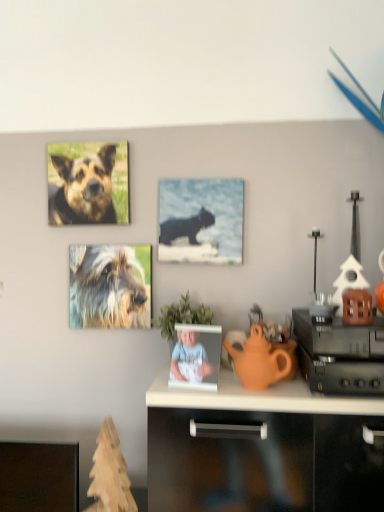
Question: Considering the relative sizes of orange matte teapot at center and matte black cat at center in the image provided, is orange matte teapot at center wider than matte black cat at center?

Choices:
 (A) yes
 (B) no

Answer: (A)

Question: Is orange matte teapot at center further to camera compared to matte black cat at center?

Choices:
 (A) no
 (B) yes

Answer: (A)

Question: From the image's perspective, would you say orange matte teapot at center is shown under matte black cat at center?

Choices:
 (A) yes
 (B) no

Answer: (A)

Question: Can you confirm if orange matte teapot at center is positioned to the right of matte black cat at center?

Choices:
 (A) no
 (B) yes

Answer: (B)

Question: Would you say matte black cat at center is part of orange matte teapot at center's contents?

Choices:
 (A) no
 (B) yes

Answer: (A)

Question: Is orange matte teapot at center aimed at matte black cat at center?

Choices:
 (A) yes
 (B) no

Answer: (B)

Question: Is green leafy plant at center at the left side of brown matte house at right?

Choices:
 (A) no
 (B) yes

Answer: (B)

Question: From a real-world perspective, is green leafy plant at center below brown matte house at right?

Choices:
 (A) yes
 (B) no

Answer: (A)

Question: Is the position of green leafy plant at center less distant than that of brown matte house at right?

Choices:
 (A) no
 (B) yes

Answer: (A)

Question: Is green leafy plant at center oriented towards brown matte house at right?

Choices:
 (A) yes
 (B) no

Answer: (B)

Question: Does green leafy plant at center have a larger size compared to brown matte house at right?

Choices:
 (A) yes
 (B) no

Answer: (A)

Question: Is green leafy plant at center shorter than brown matte house at right?

Choices:
 (A) no
 (B) yes

Answer: (A)

Question: Does orange matte teapot at center have a larger size compared to brown fur dog at upper left, arranged as the 2th dog when ordered from the bottom?

Choices:
 (A) yes
 (B) no

Answer: (A)